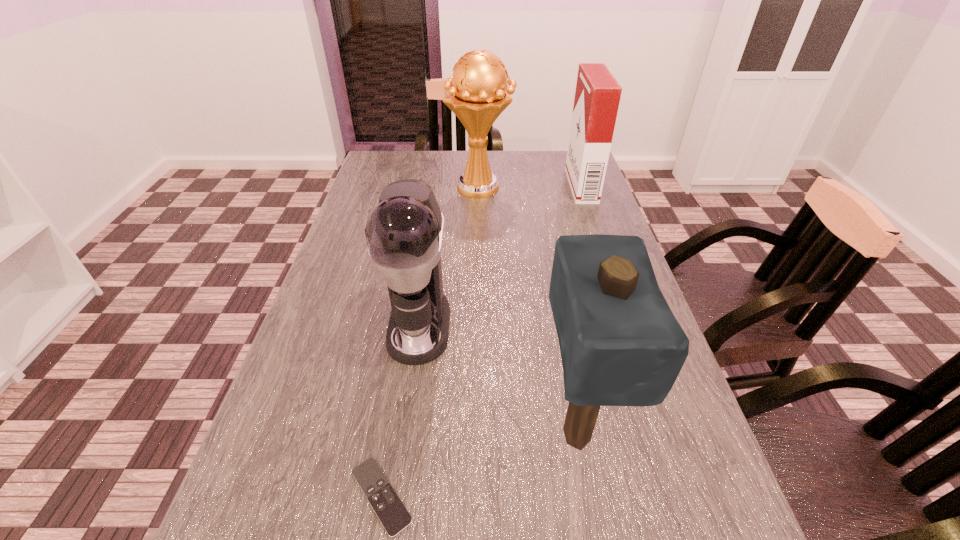
Identify the location of free point at the far left corner. Image resolution: width=960 pixels, height=540 pixels. click(x=377, y=173).

Where is `free spot at the far right corner of the desktop`? The height and width of the screenshot is (540, 960). free spot at the far right corner of the desktop is located at coordinates (553, 172).

Locate an element on the screen. The image size is (960, 540). free point between the mallet and the third nearest object is located at coordinates (497, 380).

Locate an element on the screen. vacant area that lies between the mallet and the trophy_cup is located at coordinates (528, 310).

The height and width of the screenshot is (540, 960). In order to click on vacant area that lies between the coffee maker and the rightmost object in this screenshot , I will do `click(500, 256)`.

Identify the location of empty space between the third farthest object and the second object from right to left. (497, 380).

At what (x,y) coordinates should I click in order to perform the action: click on vacant region between the remote control and the cigarette_case. Please return your answer as a coordinate pair (x, y). This screenshot has height=540, width=960. Looking at the image, I should click on (x=481, y=341).

The width and height of the screenshot is (960, 540). I want to click on free space between the third nearest object and the rightmost object, so click(500, 256).

Identify the location of vacant area between the rightmost object and the trophy_cup. (531, 186).

Choose which object is the second nearest neighbor to the coffee maker. Please provide its 2D coordinates. Your answer should be formatted as a tuple, i.e. [(x, y)], where the tuple contains the x and y coordinates of a point satisfying the conditions above.

[(393, 515)]